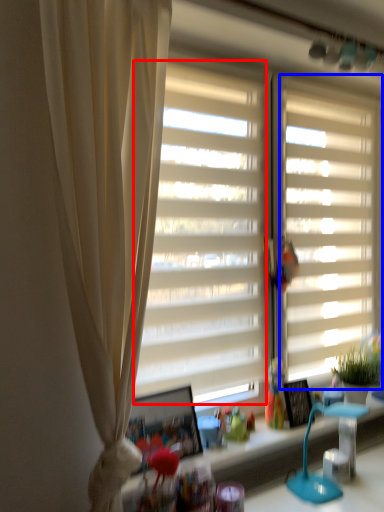
Question: Which point is closer to the camera, window screen (highlighted by a red box) or window blind (highlighted by a blue box)?

Choices:
 (A) window screen
 (B) window blind

Answer: (A)